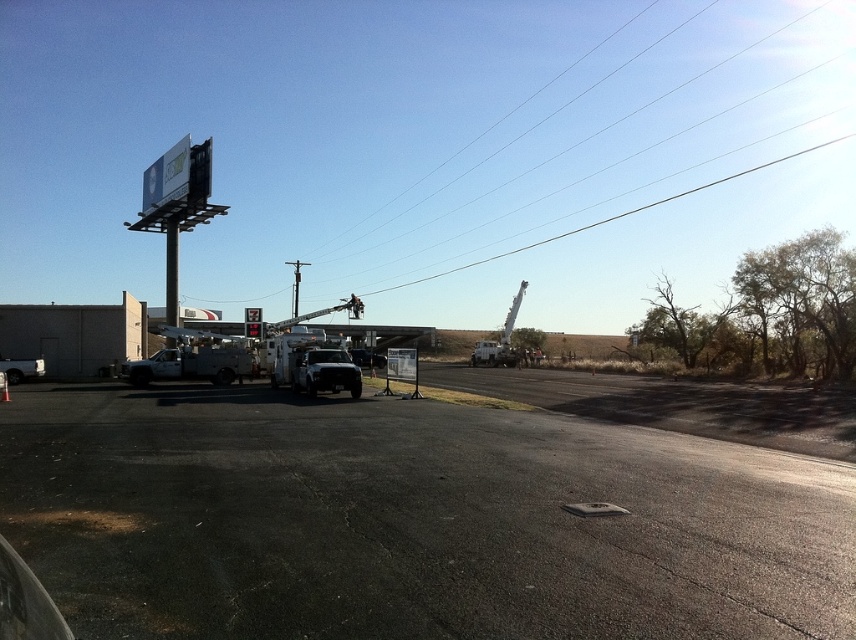
Question: Is clear wire at upper center to the left of white matte utility truck at center from the viewer's perspective?

Choices:
 (A) no
 (B) yes

Answer: (A)

Question: Can you confirm if white matte utility truck at left is bigger than brushed metal pole at left?

Choices:
 (A) no
 (B) yes

Answer: (A)

Question: Which object appears farthest from the camera in this image?

Choices:
 (A) clear wire at upper center
 (B) white matte utility truck at left
 (C) brushed metal pole at left
 (D) white matte utility truck at center

Answer: (A)

Question: Which point is farther from the camera taking this photo?

Choices:
 (A) (290, 353)
 (B) (171, 260)
 (C) (361, 221)

Answer: (C)

Question: Is white matte utility truck at left smaller than brushed metal pole at left?

Choices:
 (A) yes
 (B) no

Answer: (A)

Question: Among these points, which one is nearest to the camera?

Choices:
 (A) (375, 212)
 (B) (169, 312)

Answer: (B)